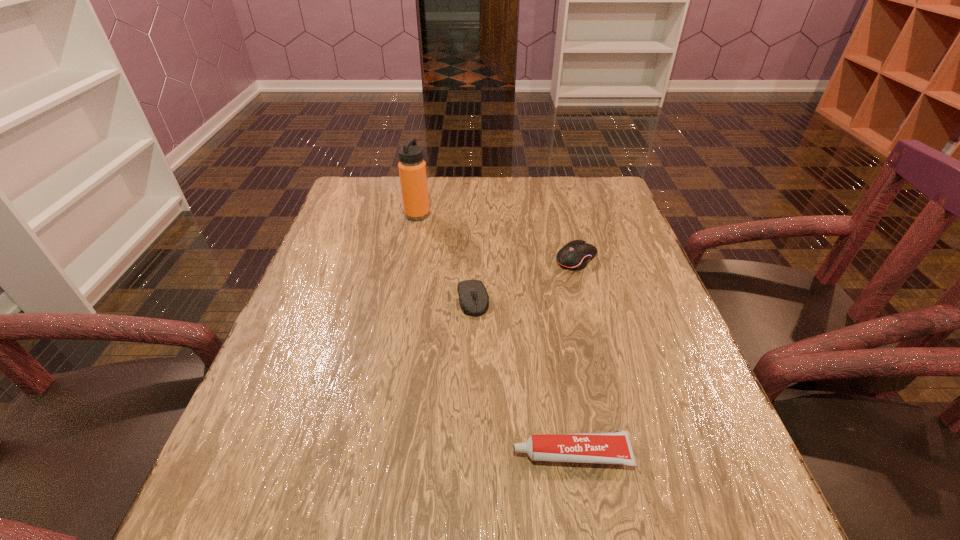
At what (x,y) coordinates should I click in order to perform the action: click on free space located 0.310m at the nozzle of the toothpaste. Please return your answer as a coordinate pair (x, y). The height and width of the screenshot is (540, 960). Looking at the image, I should click on (323, 454).

The width and height of the screenshot is (960, 540). Find the location of `vacant position located at the nozzle of the toothpaste`. vacant position located at the nozzle of the toothpaste is located at coordinates (317, 454).

In order to click on free spot located 0.310m on the right of the left computer equipment in this screenshot , I will do `click(627, 300)`.

Locate an element on the screen. The image size is (960, 540). object located in the far edge section of the desktop is located at coordinates (412, 168).

The height and width of the screenshot is (540, 960). Find the location of `object at the right edge`. object at the right edge is located at coordinates (576, 254).

Identify the location of free space at the far edge of the desktop. This screenshot has height=540, width=960. (x=540, y=190).

At what (x,y) coordinates should I click in order to perform the action: click on vacant space at the left edge. Please return your answer as a coordinate pair (x, y). The width and height of the screenshot is (960, 540). Looking at the image, I should click on (294, 412).

Image resolution: width=960 pixels, height=540 pixels. I want to click on free space at the right edge of the desktop, so click(x=600, y=232).

Identify the location of free space at the far left corner of the desktop. The image size is (960, 540). coord(377,188).

Find the location of a particular element. The width and height of the screenshot is (960, 540). free region at the near left corner of the desktop is located at coordinates (227, 528).